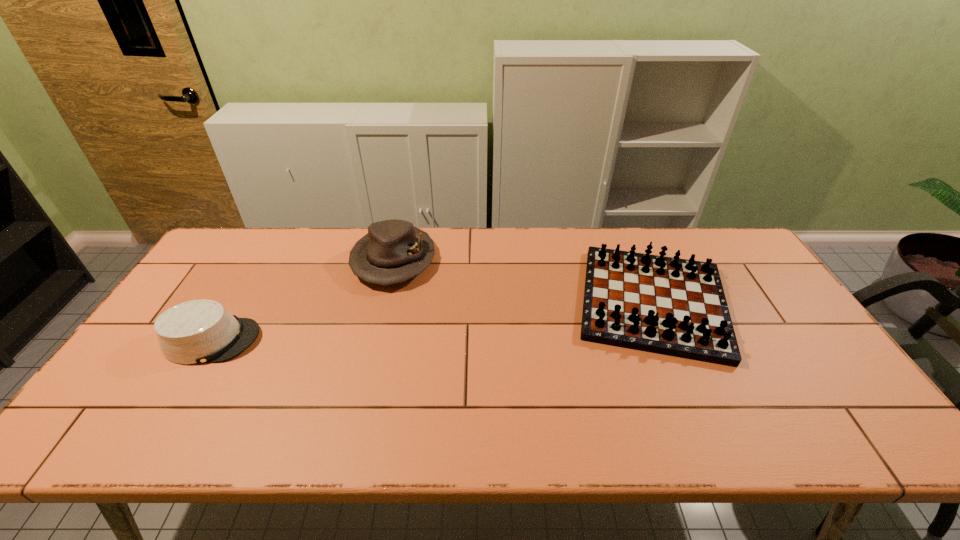
You are a GUI agent. You are given a task and a screenshot of the screen. Output one action in this format:
    pyautogui.click(x=<x>, y=<y>)
    Task: Click on the farther hat
    Image resolution: width=960 pixels, height=540 pixels.
    Given the screenshot: What is the action you would take?
    pyautogui.click(x=393, y=251)

Image resolution: width=960 pixels, height=540 pixels. Find the location of `the taller hat`. the taller hat is located at coordinates [393, 251].

This screenshot has height=540, width=960. In order to click on the rightmost object in this screenshot , I will do `click(677, 307)`.

Where is `the leftmost object`? This screenshot has width=960, height=540. the leftmost object is located at coordinates (200, 331).

The image size is (960, 540). Find the location of `the shorter hat`. the shorter hat is located at coordinates (200, 331).

Find the location of `free location located on the decorative side of the farther hat`. free location located on the decorative side of the farther hat is located at coordinates 381,312.

Where is `vacant area situated 0.070m on the left of the rightmost object`? This screenshot has width=960, height=540. vacant area situated 0.070m on the left of the rightmost object is located at coordinates (548, 302).

The height and width of the screenshot is (540, 960). Identify the location of vacant region located on the front-facing side of the leftmost object. (334, 340).

This screenshot has height=540, width=960. I want to click on hat that is at the far edge, so click(x=393, y=251).

Locate an element on the screen. The width and height of the screenshot is (960, 540). chessboard at the far edge is located at coordinates (677, 307).